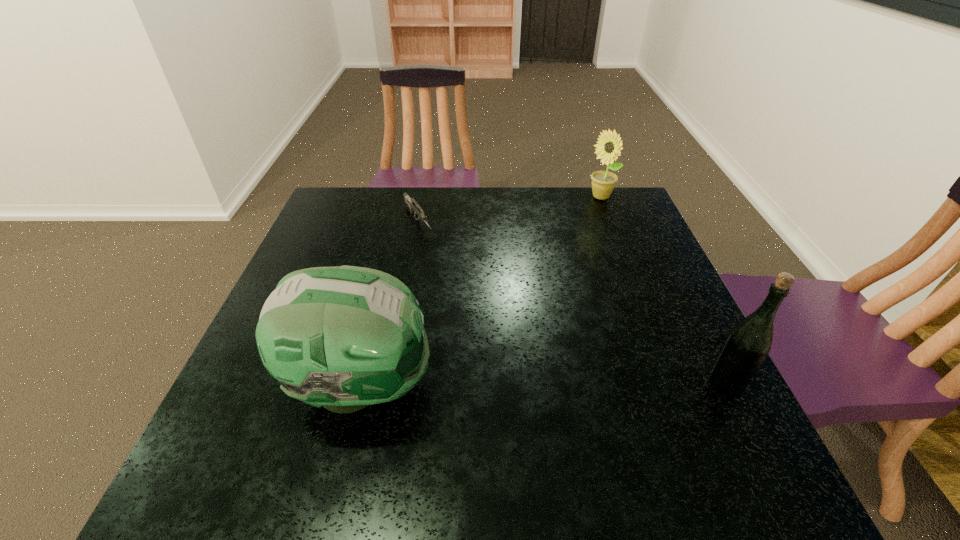
What are the coordinates of `vacant space located 0.050m aimed along the barrel of the shortest object` in the screenshot? It's located at (431, 247).

Find the location of a particular element. The image size is (960, 540). free spot located aimed along the barrel of the shortest object is located at coordinates pyautogui.click(x=470, y=300).

The image size is (960, 540). Identify the location of vacant area situated 0.160m aimed along the barrel of the shortest object. (447, 269).

In order to click on sunflower present at the far edge in this screenshot , I will do `click(609, 145)`.

Identify the location of gun located at the far edge. (412, 204).

Identify the location of football helmet that is at the near edge. The height and width of the screenshot is (540, 960). (345, 337).

The image size is (960, 540). Identify the location of beer bottle that is positioned at the near edge. (749, 342).

Where is `object at the left edge`? This screenshot has height=540, width=960. object at the left edge is located at coordinates coord(345,337).

This screenshot has width=960, height=540. What are the coordinates of `beer bottle present at the right edge` in the screenshot? It's located at (749, 342).

In order to click on sunflower present at the right edge in this screenshot , I will do `click(609, 145)`.